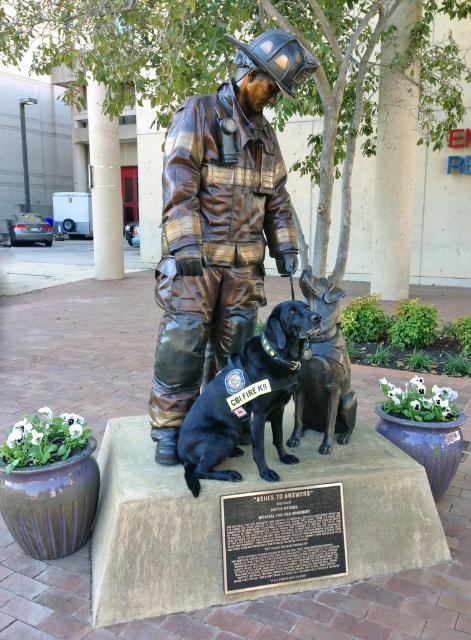
Is bronze statue at center to the right of black glossy dog at center from the viewer's perspective?

In fact, bronze statue at center is to the left of black glossy dog at center.

Which is behind, point (186, 394) or point (293, 445)?

The point (293, 445) is more distant.

Locate an element on the screen. The image size is (471, 640). bronze statue at center is located at coordinates (219, 225).

Can you confirm if bronze statue at center is bigger than shiny black dog at center?

Indeed, bronze statue at center has a larger size compared to shiny black dog at center.

Is point (238, 337) closer to camera compared to point (269, 314)?

Yes, it is.

At what (x,y) coordinates should I click in order to perform the action: click on bronze statue at center. Please return your answer as a coordinate pair (x, y). The height and width of the screenshot is (640, 471). Looking at the image, I should click on (219, 225).

How much distance is there between shiny black dog at center and black glossy dog at center?

shiny black dog at center is 26.29 centimeters from black glossy dog at center.

Does shiny black dog at center have a larger size compared to black glossy dog at center?

Indeed, shiny black dog at center has a larger size compared to black glossy dog at center.

Is point (230, 384) positioned in front of point (309, 298)?

Yes, point (230, 384) is closer to viewer.

This screenshot has width=471, height=640. I want to click on shiny black dog at center, so click(246, 400).